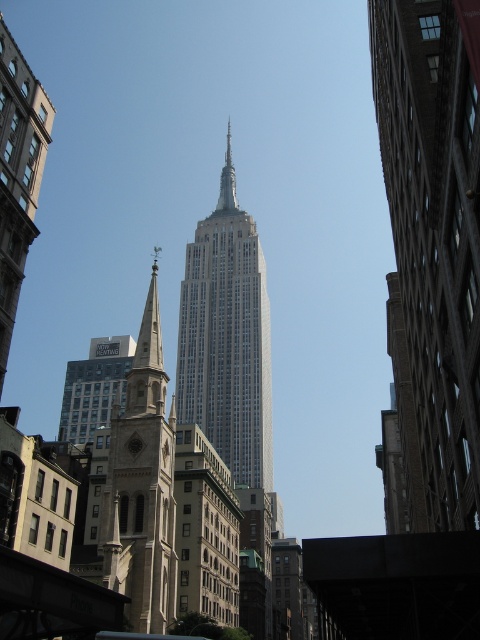
Is light brown stone church steeple at left smaller than silver metallic spire at center?

Actually, light brown stone church steeple at left might be larger than silver metallic spire at center.

Who is lower down, light brown stone church steeple at left or silver metallic spire at center?

Positioned lower is light brown stone church steeple at left.

Which is behind, point (162, 552) or point (230, 156)?

The point (230, 156) is behind.

Locate an element on the screen. light brown stone church steeple at left is located at coordinates (143, 484).

Can you confirm if smooth stone tower at center is taller than smooth stone tower at left?

Yes, smooth stone tower at center is taller than smooth stone tower at left.

Which is in front, point (402, 248) or point (26, 237)?

Point (26, 237) is more forward.

Does point (417, 438) come behind point (0, 129)?

That is True.

Find the location of a particular element. This screenshot has width=480, height=640. smooth stone tower at center is located at coordinates (432, 246).

The width and height of the screenshot is (480, 640). What do you see at coordinates (227, 339) in the screenshot? I see `white glass skyscraper at center` at bounding box center [227, 339].

What do you see at coordinates (227, 339) in the screenshot? The image size is (480, 640). I see `white glass skyscraper at center` at bounding box center [227, 339].

The image size is (480, 640). What are the coordinates of `white glass skyscraper at center` in the screenshot? It's located at (x=227, y=339).